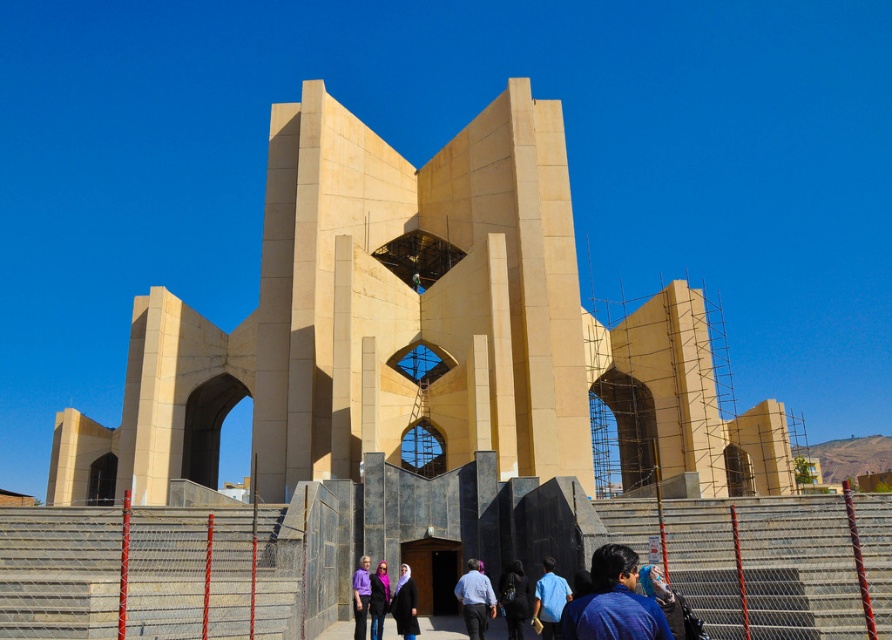
Is blue fabric at lower right behind light blue shirt at center?

No, blue fabric at lower right is closer to the viewer.

Locate an element on the screen. blue fabric at lower right is located at coordinates (613, 602).

Can you confirm if blue fabric shirt at lower right is positioned to the left of matte purple scarf at center?

In fact, blue fabric shirt at lower right is to the right of matte purple scarf at center.

Is blue fabric shirt at lower right bigger than matte purple scarf at center?

Indeed, blue fabric shirt at lower right has a larger size compared to matte purple scarf at center.

Is point (542, 628) positioned before point (370, 600)?

That is True.

The width and height of the screenshot is (892, 640). In order to click on blue fabric shirt at lower right in this screenshot , I will do `click(550, 600)`.

This screenshot has width=892, height=640. What do you see at coordinates (59, 572) in the screenshot?
I see `gray concrete stairs at lower left` at bounding box center [59, 572].

Between point (263, 625) and point (521, 593), which one is positioned behind?

The point (521, 593) is behind.

The width and height of the screenshot is (892, 640). In order to click on gray concrete stairs at lower left in this screenshot , I will do `click(59, 572)`.